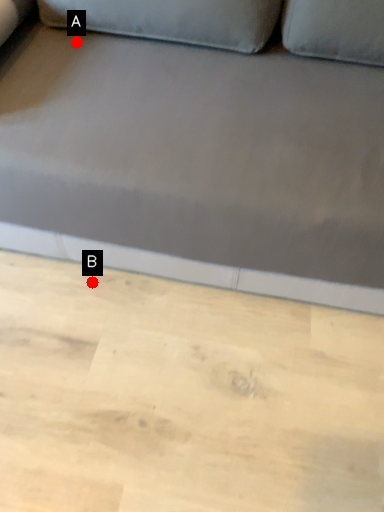
Question: Two points are circled on the image, labeled by A and B beside each circle. Which point appears farthest from the camera in this image?

Choices:
 (A) A is further
 (B) B is further

Answer: (B)